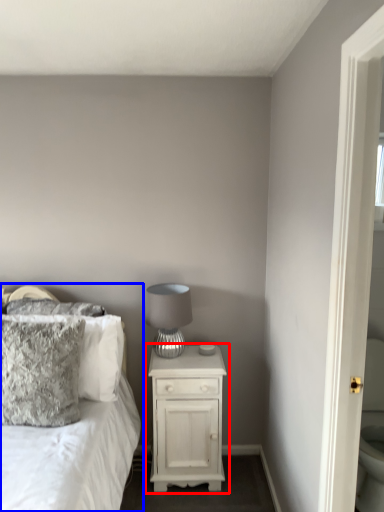
Question: Which object appears closest to the camera in this image, nightstand (highlighted by a red box) or bed (highlighted by a blue box)?

Choices:
 (A) nightstand
 (B) bed

Answer: (B)